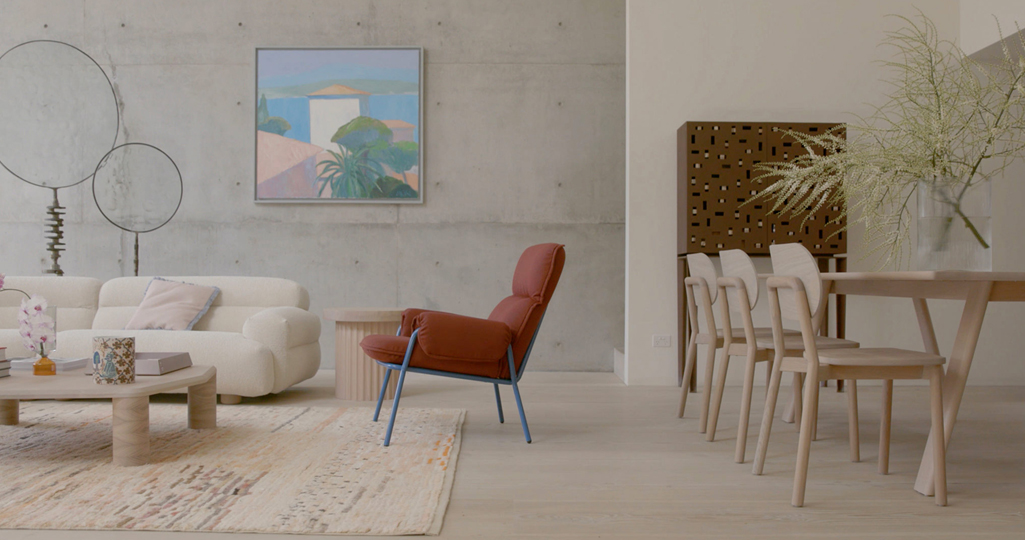
Where is `wall above painting`? The height and width of the screenshot is (540, 1025). wall above painting is located at coordinates (336, 11).